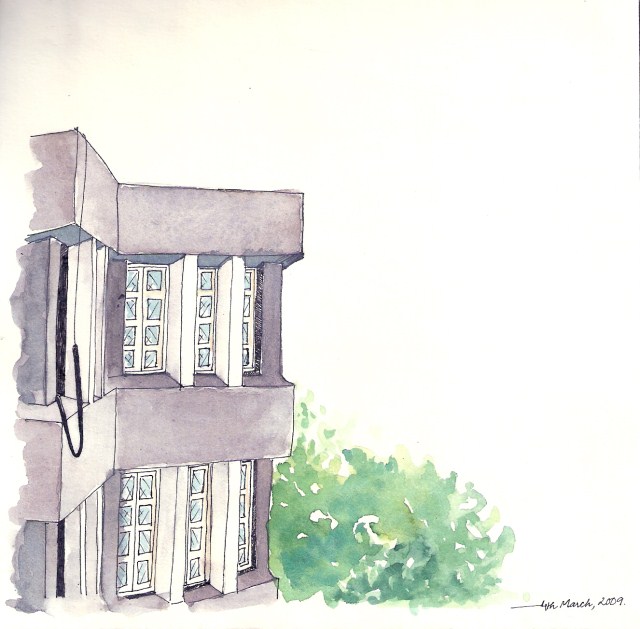
Find the location of a particular element. The width and height of the screenshot is (640, 629). concrete pillar is located at coordinates (276, 335).